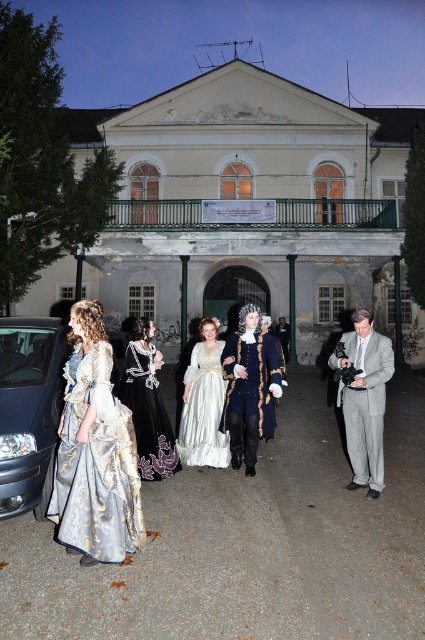
Is gray fabric suit at right behind white satin gown at center?

No, it is in front of white satin gown at center.

Describe the element at coordinates (365, 400) in the screenshot. The image size is (425, 640). I see `gray fabric suit at right` at that location.

Where is `gray fabric suit at right`? gray fabric suit at right is located at coordinates (365, 400).

Can you confirm if black satin gown at center is shorter than white satin gown at center?

Correct, black satin gown at center is not as tall as white satin gown at center.

In the scene shown: Who is more distant from viewer, (x=141, y=376) or (x=204, y=317)?

The point (x=204, y=317) is behind.

Is point (153, 468) closer to viewer compared to point (184, 435)?

Yes, it is in front of point (184, 435).

Find the location of a particular element. Image resolution: width=425 pixels, height=640 pixels. black satin gown at center is located at coordinates (147, 404).

Does point (61, 406) come farther from viewer compared to point (209, 337)?

No, (61, 406) is in front of (209, 337).

Which is below, shiny black car at left or white satin gown at center?

Positioned lower is white satin gown at center.

Is point (42, 396) behind point (221, 406)?

No, (42, 396) is in front of (221, 406).

Identify the location of shiny black car at left. The height and width of the screenshot is (640, 425). point(28,404).